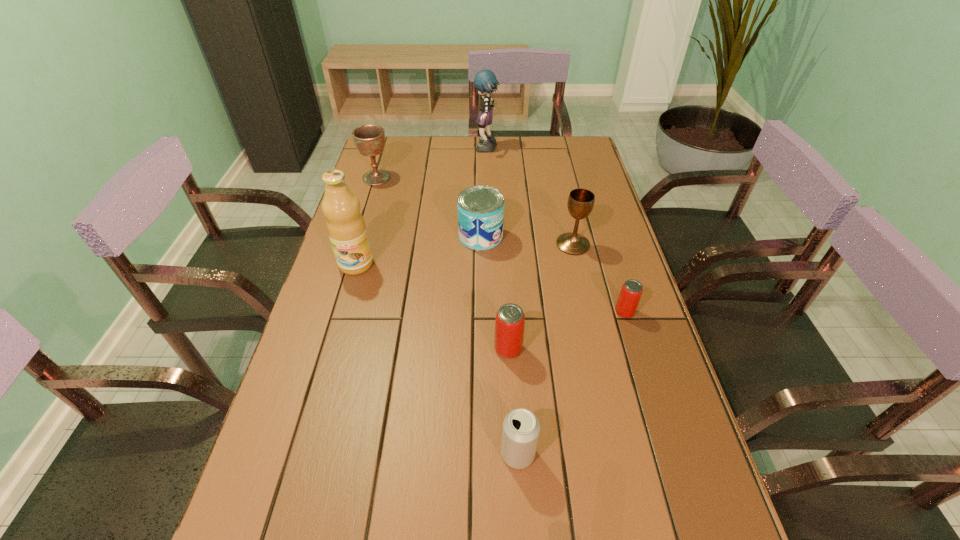
Where is `free region at the left edge of the desktop`? free region at the left edge of the desktop is located at coordinates pyautogui.click(x=363, y=191).

Identify the location of free space at the right edge. The width and height of the screenshot is (960, 540). (589, 186).

I want to click on free space at the far right corner of the desktop, so click(583, 142).

Where is `free space between the brown chalice and the rightmost beer can`? The height and width of the screenshot is (540, 960). free space between the brown chalice and the rightmost beer can is located at coordinates (500, 245).

At what (x,y) coordinates should I click in order to perform the action: click on free area in between the olive oil and the right chalice. Please return your answer as a coordinate pair (x, y). This screenshot has width=960, height=540. Looking at the image, I should click on click(465, 254).

Locate an element on the screen. vacant space in between the brown chalice and the nearest beer can is located at coordinates (447, 315).

The height and width of the screenshot is (540, 960). I want to click on vacant region between the rag doll and the nearer pink beer can, so click(497, 249).

Locate an element on the screen. vacant area that lies between the right chalice and the farthest object is located at coordinates (530, 197).

Where is `vacant space that is in between the left pink beer can and the olive oil`? The width and height of the screenshot is (960, 540). vacant space that is in between the left pink beer can and the olive oil is located at coordinates (432, 306).

At what (x,y) coordinates should I click in order to perform the action: click on free space between the blue can and the farther pink beer can. Please return your answer as a coordinate pair (x, y). Looking at the image, I should click on (553, 274).